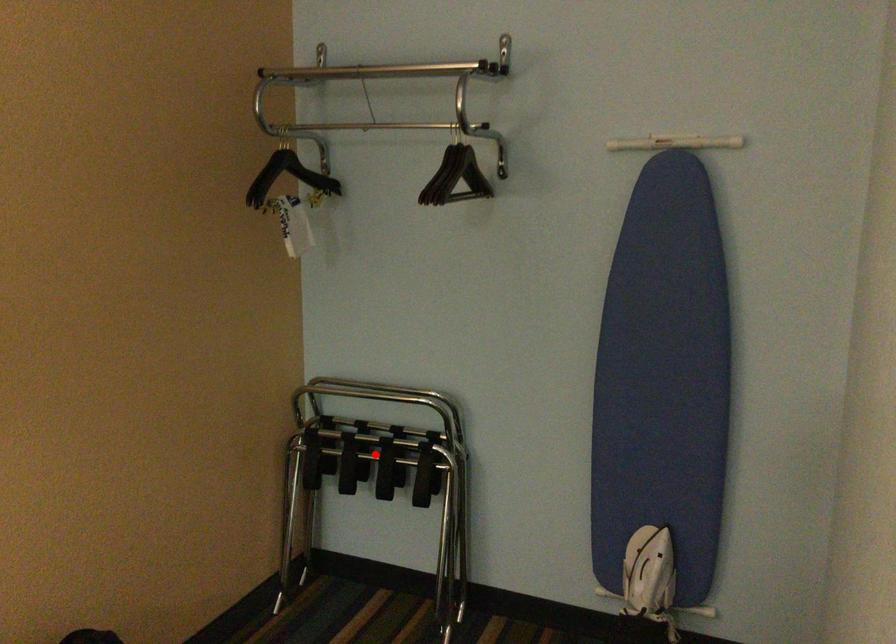
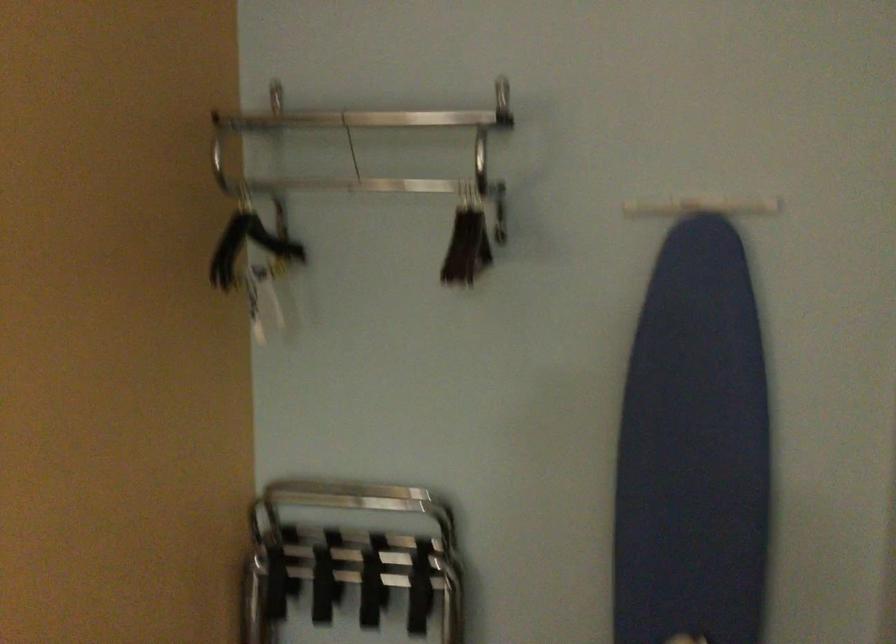
Question: I am providing you with two images of the same scene from different viewpoints. Image1 has a red point marked. In image2, the corresponding 3D location appears at what relative position? Reply with the corresponding letter.

Choices:
 (A) Closer
 (B) Farther

Answer: (A)